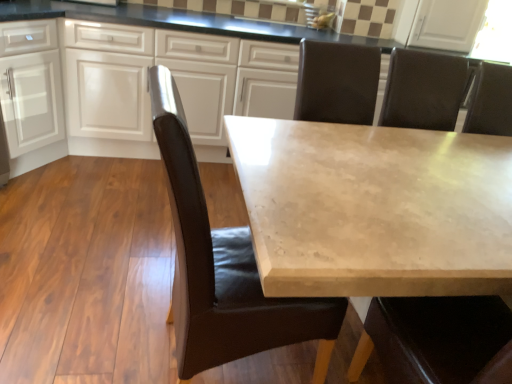
This screenshot has width=512, height=384. What do you see at coordinates (223, 268) in the screenshot? I see `brown leather chair at center` at bounding box center [223, 268].

Identify the location of beige marble table at center. (374, 208).

Describe the element at coordinates (165, 65) in the screenshot. The image size is (512, 384). I see `white glossy cabinets at upper center, which is the 2th cabinetry in left-to-right order` at that location.

Identify the location of brown leather chair at center. point(223,268).

Is white matte cabinet at left, arranged as the 2th cabinetry when viewed from the right, wider or thinner than white glossy cabinets at upper center, which is counted as the 1th cabinetry, starting from the right?

In the image, white matte cabinet at left, arranged as the 2th cabinetry when viewed from the right, appears to be more narrow than white glossy cabinets at upper center, which is counted as the 1th cabinetry, starting from the right.

Which object is closer to the camera taking this photo, white matte cabinet at left, the 1th cabinetry viewed from the left, or white glossy cabinets at upper center, which is the 2th cabinetry in left-to-right order?

Positioned in front is white glossy cabinets at upper center, which is the 2th cabinetry in left-to-right order.

Could you tell me if white matte cabinet at left, the 1th cabinetry viewed from the left, is turned towards white glossy cabinets at upper center, which is the 2th cabinetry in left-to-right order?

Yes, white matte cabinet at left, the 1th cabinetry viewed from the left, faces towards white glossy cabinets at upper center, which is the 2th cabinetry in left-to-right order.

Based on the photo, is white matte cabinet at left, the 1th cabinetry viewed from the left, in contact with white glossy cabinets at upper center, which is the 2th cabinetry in left-to-right order?

white matte cabinet at left, the 1th cabinetry viewed from the left, is not next to white glossy cabinets at upper center, which is the 2th cabinetry in left-to-right order, and they're not touching.

Is white glossy cabinets at upper center, which is the 2th cabinetry in left-to-right order, looking in the opposite direction of beige marble table at center?

Yes.

Would you say white glossy cabinets at upper center, which is counted as the 1th cabinetry, starting from the right, is to the left or to the right of beige marble table at center in the picture?

From the image, it's evident that white glossy cabinets at upper center, which is counted as the 1th cabinetry, starting from the right, is to the left of beige marble table at center.

Can you confirm if white glossy cabinets at upper center, which is the 2th cabinetry in left-to-right order, is thinner than beige marble table at center?

Correct, the width of white glossy cabinets at upper center, which is the 2th cabinetry in left-to-right order, is less than that of beige marble table at center.

Considering the positions of objects white matte cabinet at left, arranged as the 2th cabinetry when viewed from the right, and beige marble table at center in the image provided, who is more to the left, white matte cabinet at left, arranged as the 2th cabinetry when viewed from the right, or beige marble table at center?

white matte cabinet at left, arranged as the 2th cabinetry when viewed from the right.

Which object is further away from the camera, white matte cabinet at left, the 1th cabinetry viewed from the left, or beige marble table at center?

white matte cabinet at left, the 1th cabinetry viewed from the left, is behind.

How many degrees apart are the facing directions of white matte cabinet at left, the 1th cabinetry viewed from the left, and beige marble table at center?

There is a 56-degree angle between the facing directions of white matte cabinet at left, the 1th cabinetry viewed from the left, and beige marble table at center.

Is white matte cabinet at left, arranged as the 2th cabinetry when viewed from the right, bigger or smaller than beige marble table at center?

In the image, white matte cabinet at left, arranged as the 2th cabinetry when viewed from the right, appears to be smaller than beige marble table at center.

Considering the sizes of objects beige marble table at center and white glossy cabinets at upper center, which is counted as the 1th cabinetry, starting from the right, in the image provided, who is smaller, beige marble table at center or white glossy cabinets at upper center, which is counted as the 1th cabinetry, starting from the right,?

beige marble table at center is smaller.

Which object is further away from the camera taking this photo, beige marble table at center or white glossy cabinets at upper center, which is the 2th cabinetry in left-to-right order?

Positioned behind is white glossy cabinets at upper center, which is the 2th cabinetry in left-to-right order.

How different are the orientations of beige marble table at center and white glossy cabinets at upper center, which is the 2th cabinetry in left-to-right order, in degrees?

There is a 0.667-degree angle between the facing directions of beige marble table at center and white glossy cabinets at upper center, which is the 2th cabinetry in left-to-right order.

From a real-world perspective, is beige marble table at center beneath white glossy cabinets at upper center, which is counted as the 1th cabinetry, starting from the right?

Yes, from a real-world perspective, beige marble table at center is under white glossy cabinets at upper center, which is counted as the 1th cabinetry, starting from the right.

Can you confirm if white glossy cabinets at upper center, which is counted as the 1th cabinetry, starting from the right, is thinner than brown leather chair at center?

No, white glossy cabinets at upper center, which is counted as the 1th cabinetry, starting from the right, is not thinner than brown leather chair at center.

This screenshot has height=384, width=512. What are the coordinates of `cabinetry that is the 1st one below the brown leather chair at center (from a real-world perspective)` in the screenshot? It's located at (165, 65).

Measure the distance between white glossy cabinets at upper center, which is counted as the 1th cabinetry, starting from the right, and brown leather chair at center.

They are 5.10 feet apart.

Is white glossy cabinets at upper center, which is counted as the 1th cabinetry, starting from the right, at the right side of brown leather chair at center?

In fact, white glossy cabinets at upper center, which is counted as the 1th cabinetry, starting from the right, is to the left of brown leather chair at center.

From the image's perspective, which object appears higher, brown leather chair at center or white glossy cabinets at upper center, which is the 2th cabinetry in left-to-right order?

white glossy cabinets at upper center, which is the 2th cabinetry in left-to-right order, from the image's perspective.

Does brown leather chair at center have a larger size compared to white glossy cabinets at upper center, which is the 2th cabinetry in left-to-right order?

Incorrect, brown leather chair at center is not larger than white glossy cabinets at upper center, which is the 2th cabinetry in left-to-right order.

Considering the relative positions of brown leather chair at center and white glossy cabinets at upper center, which is counted as the 1th cabinetry, starting from the right, in the image provided, is brown leather chair at center to the right of white glossy cabinets at upper center, which is counted as the 1th cabinetry, starting from the right, from the viewer's perspective?

Yes, brown leather chair at center is to the right of white glossy cabinets at upper center, which is counted as the 1th cabinetry, starting from the right.

Is point (320, 366) more distant than point (67, 74)?

No, (320, 366) is closer to viewer.

From a real-world perspective, is brown leather chair at center located beneath beige marble table at center?

No, from a real-world perspective, brown leather chair at center is not under beige marble table at center.

This screenshot has width=512, height=384. Find the location of `chair above the beige marble table at center (from the image's perspective)`. chair above the beige marble table at center (from the image's perspective) is located at coordinates (223, 268).

Based on the photo, from the image's perspective, is brown leather chair at center beneath beige marble table at center?

No, from the image's perspective, brown leather chair at center is not beneath beige marble table at center.

Image resolution: width=512 pixels, height=384 pixels. Find the location of `cabinetry that appears above the white matte cabinet at left, arranged as the 2th cabinetry when viewed from the right (from a real-world perspective)`. cabinetry that appears above the white matte cabinet at left, arranged as the 2th cabinetry when viewed from the right (from a real-world perspective) is located at coordinates (165, 65).

The image size is (512, 384). I want to click on table in front of the white glossy cabinets at upper center, which is the 2th cabinetry in left-to-right order, so click(374, 208).

From the image, which object appears to be nearer to white glossy cabinets at upper center, which is counted as the 1th cabinetry, starting from the right, white matte cabinet at left, the 1th cabinetry viewed from the left, or beige marble table at center?

Among the two, white matte cabinet at left, the 1th cabinetry viewed from the left, is located nearer to white glossy cabinets at upper center, which is counted as the 1th cabinetry, starting from the right.

When comparing their distances from white glossy cabinets at upper center, which is counted as the 1th cabinetry, starting from the right, does brown leather chair at center or beige marble table at center seem further?

brown leather chair at center.

Which object lies nearer to the anchor point white matte cabinet at left, arranged as the 2th cabinetry when viewed from the right, white glossy cabinets at upper center, which is the 2th cabinetry in left-to-right order, or beige marble table at center?

The object closer to white matte cabinet at left, arranged as the 2th cabinetry when viewed from the right, is white glossy cabinets at upper center, which is the 2th cabinetry in left-to-right order.

Estimate the real-world distances between objects in this image. Which object is further from white glossy cabinets at upper center, which is the 2th cabinetry in left-to-right order, beige marble table at center or white matte cabinet at left, the 1th cabinetry viewed from the left?

Among the two, beige marble table at center is located further to white glossy cabinets at upper center, which is the 2th cabinetry in left-to-right order.

Based on the photo, considering their positions, is white glossy cabinets at upper center, which is counted as the 1th cabinetry, starting from the right, positioned closer to beige marble table at center than white matte cabinet at left, the 1th cabinetry viewed from the left?

white glossy cabinets at upper center, which is counted as the 1th cabinetry, starting from the right, is closer to beige marble table at center.

Considering their positions, is white matte cabinet at left, arranged as the 2th cabinetry when viewed from the right, positioned further to white glossy cabinets at upper center, which is counted as the 1th cabinetry, starting from the right, than brown leather chair at center?

brown leather chair at center is further to white glossy cabinets at upper center, which is counted as the 1th cabinetry, starting from the right.

From the image, which object appears to be nearer to beige marble table at center, white matte cabinet at left, the 1th cabinetry viewed from the left, or brown leather chair at center?

brown leather chair at center.

Estimate the real-world distances between objects in this image. Which object is further from beige marble table at center, white matte cabinet at left, the 1th cabinetry viewed from the left, or white glossy cabinets at upper center, which is counted as the 1th cabinetry, starting from the right?

white matte cabinet at left, the 1th cabinetry viewed from the left, lies further to beige marble table at center than the other object.

At what (x,y) coordinates should I click in order to perform the action: click on table between brown leather chair at center and white glossy cabinets at upper center, which is the 2th cabinetry in left-to-right order, from front to back. Please return your answer as a coordinate pair (x, y). Looking at the image, I should click on (374, 208).

Find the location of a particular element. This screenshot has height=384, width=512. cabinetry located between white matte cabinet at left, the 1th cabinetry viewed from the left, and beige marble table at center in the left-right direction is located at coordinates (165, 65).

Identify the location of cabinetry located between white matte cabinet at left, arranged as the 2th cabinetry when viewed from the right, and brown leather chair at center in the left-right direction. (165, 65).

At what (x,y) coordinates should I click in order to perform the action: click on chair between white matte cabinet at left, arranged as the 2th cabinetry when viewed from the right, and beige marble table at center, in the horizontal direction. Please return your answer as a coordinate pair (x, y). The height and width of the screenshot is (384, 512). Looking at the image, I should click on (223, 268).